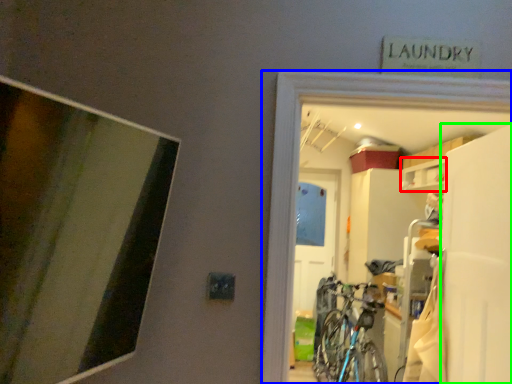
Question: Estimate the real-world distances between objects in this image. Which object is closer to cabinet (highlighted by a red box), garage (highlighted by a blue box) or screen door (highlighted by a green box)?

Choices:
 (A) garage
 (B) screen door

Answer: (B)